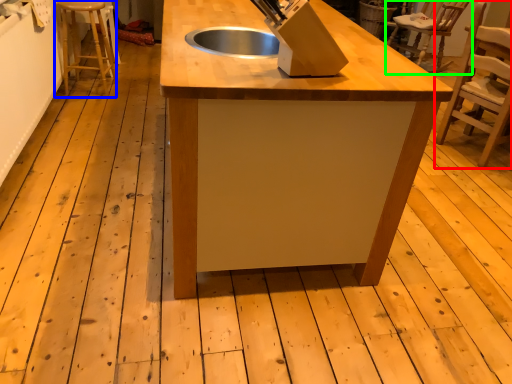
Question: Which is nearer to the chair (highlighted by a red box)? step stool (highlighted by a blue box) or chair (highlighted by a green box).

Choices:
 (A) step stool
 (B) chair

Answer: (B)